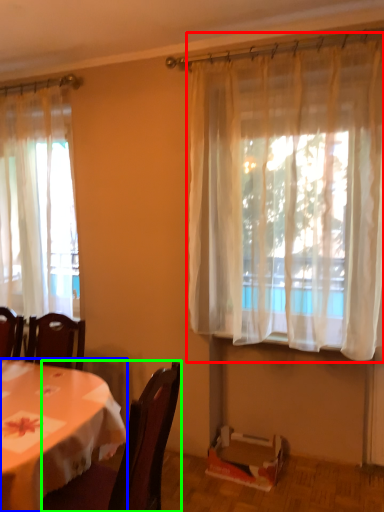
Question: Which object is positioned farthest from curtain (highlighted by a red box)? Select from desk (highlighted by a blue box) and chair (highlighted by a green box).

Choices:
 (A) desk
 (B) chair

Answer: (A)